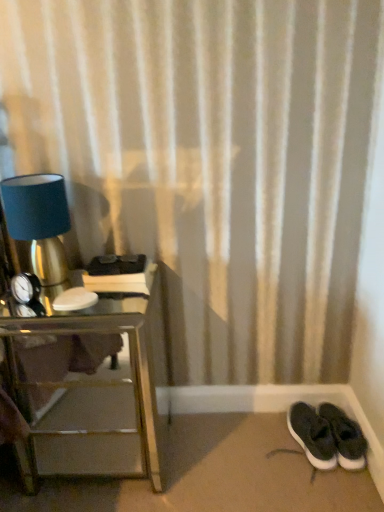
Question: In terms of width, does black suede sneakers at lower right look wider or thinner when compared to matte blue lampshade at left?

Choices:
 (A) wide
 (B) thin

Answer: (A)

Question: Considering the relative positions of black suede sneakers at lower right and matte blue lampshade at left in the image provided, is black suede sneakers at lower right to the left or to the right of matte blue lampshade at left?

Choices:
 (A) right
 (B) left

Answer: (A)

Question: Which of these objects is positioned farthest from the matte blue lampshade at left?

Choices:
 (A) black suede sneakers at lower right
 (B) silver mirrored nightstand at left

Answer: (A)

Question: Estimate the real-world distances between objects in this image. Which object is farther from the silver mirrored nightstand at left?

Choices:
 (A) matte blue lampshade at left
 (B) black suede sneakers at lower right

Answer: (B)